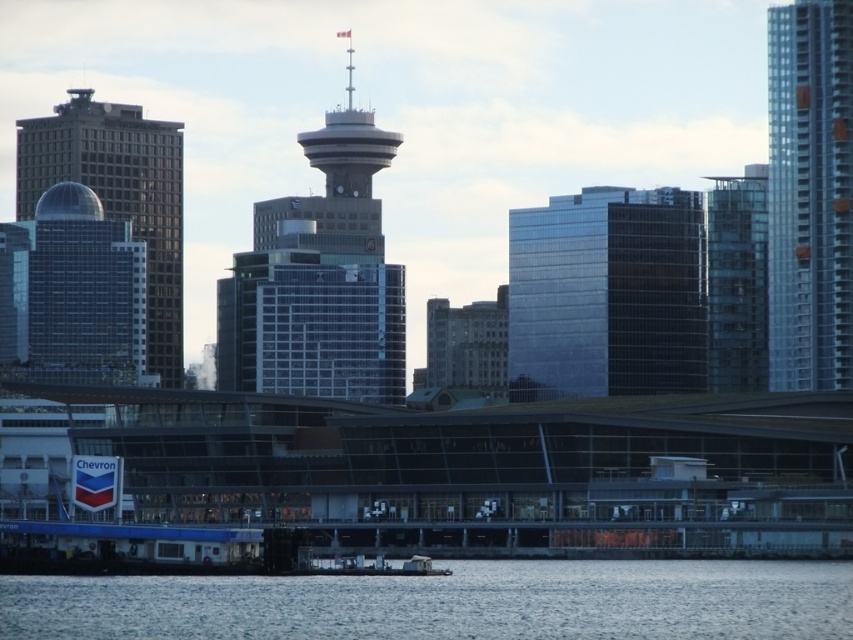
You are a drone operator trying to navigate between two buildings in the city. You need to fly your drone from the shiny glass building at center to the clear glass skyscraper at right. Based on their positions, which direction should you direct the drone to move first?

The shiny glass building at center is located below the clear glass skyscraper at right, so the drone should first move upward to reach the clear glass skyscraper at right.

You are a drone operator trying to navigate between the glassy blue skyscraper at center and the metallic gray boat at lower center. Based on the scene, can you determine which object is positioned higher in the image?

The glassy blue skyscraper at center is above the metallic gray boat at lower center, so it is positioned higher in the image.